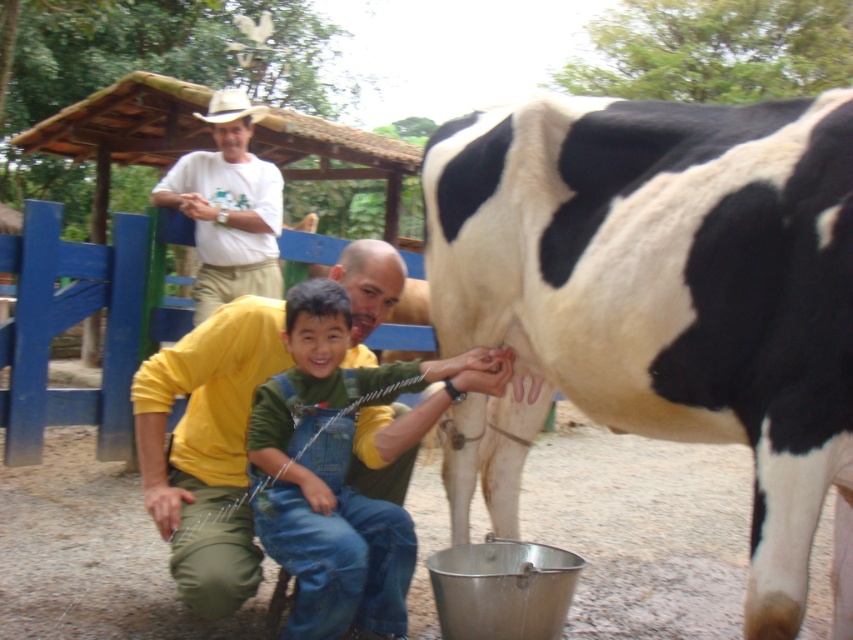
Does point (299, 506) come in front of point (281, 208)?

That is True.

Who is positioned more to the right, green denim overalls at center or white cotton shirt at upper center?

green denim overalls at center is more to the right.

Who is more forward, [366,536] or [218,157]?

Point [366,536] is in front.

What are the coordinates of `green denim overalls at center` in the screenshot? It's located at (334, 472).

Which is in front, point (345, 289) or point (209, 220)?

Point (345, 289)

Does yellow cotton shirt at center have a lesser width compared to white cotton shirt at upper center?

Incorrect, yellow cotton shirt at center's width is not less than white cotton shirt at upper center's.

Between point (238, 426) and point (199, 259), which one is positioned behind?

Positioned behind is point (199, 259).

Where is `yellow cotton shirt at center`? yellow cotton shirt at center is located at coordinates (207, 449).

Is point (186, 388) positioned after point (291, 417)?

Yes, it is behind point (291, 417).

In the scene shown: Is yellow cotton shirt at center to the right of green denim overalls at center from the viewer's perspective?

Incorrect, yellow cotton shirt at center is not on the right side of green denim overalls at center.

Is point (218, 573) positioned in front of point (309, 564)?

No.

Find the location of a particular element. yellow cotton shirt at center is located at coordinates (207, 449).